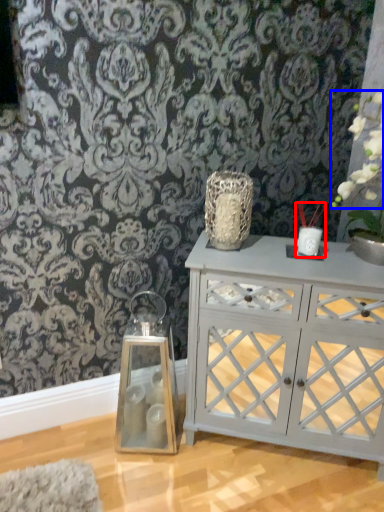
Question: Which point is closer to the camera, candle holder (highlighted by a red box) or floral arrangement (highlighted by a blue box)?

Choices:
 (A) candle holder
 (B) floral arrangement

Answer: (B)